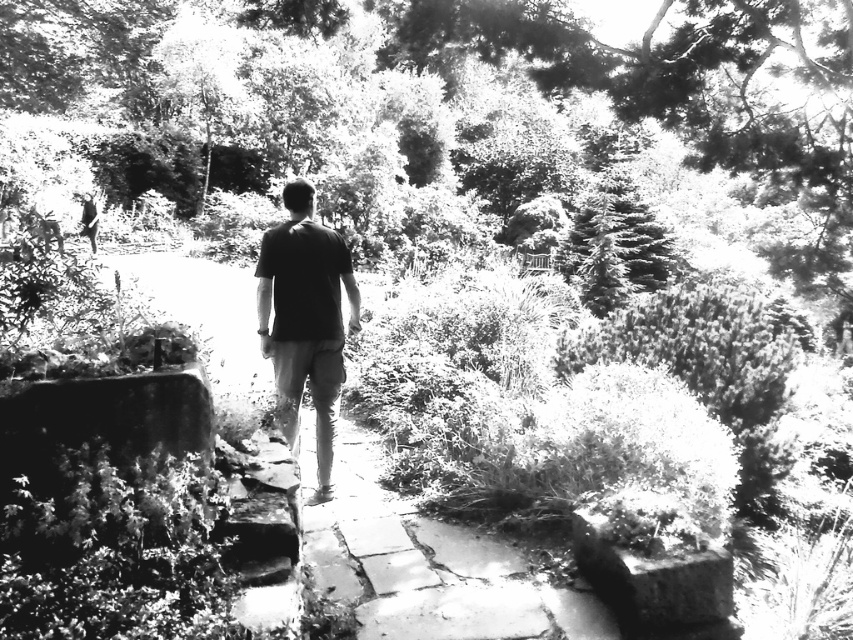
Is black matte shirt at center below smooth green pine tree at upper right?

Yes, black matte shirt at center is below smooth green pine tree at upper right.

Which of these two, black matte shirt at center or smooth green pine tree at upper right, stands taller?

Standing taller between the two is smooth green pine tree at upper right.

Is point (320, 465) positioned after point (659, 288)?

No, (320, 465) is closer to viewer.

Locate an element on the screen. The width and height of the screenshot is (853, 640). black matte shirt at center is located at coordinates (305, 320).

Based on the photo, between smooth stone pavement at center and black matte shirt at center, which one is positioned lower?

smooth stone pavement at center is below.

Which of these two, smooth stone pavement at center or black matte shirt at center, stands taller?

With more height is black matte shirt at center.

Does point (430, 531) lie behind point (329, 408)?

No, (430, 531) is in front of (329, 408).

The width and height of the screenshot is (853, 640). Identify the location of smooth stone pavement at center. (430, 566).

Identify the location of smooth stone pavement at center. This screenshot has height=640, width=853. (430, 566).

Where is `smooth stone pavement at center`? Image resolution: width=853 pixels, height=640 pixels. smooth stone pavement at center is located at coordinates (430, 566).